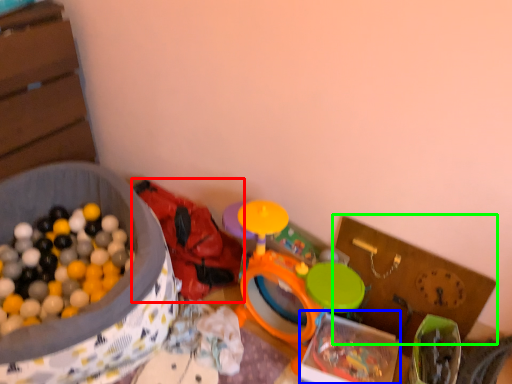
Question: Estimate the real-world distances between objects in this image. Which object is closer to toy (highlighted by a red box), box (highlighted by a blue box) or cardboard box (highlighted by a green box)?

Choices:
 (A) box
 (B) cardboard box

Answer: (A)